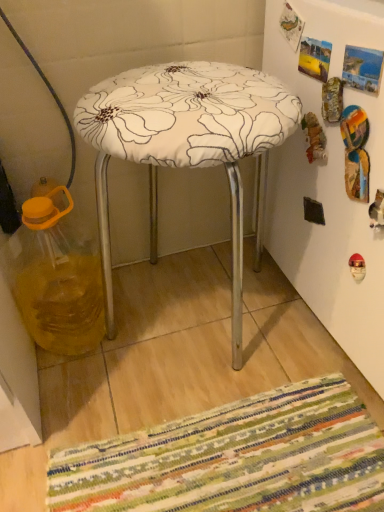
Question: From a real-world perspective, is translucent yellow liquid at left above or below white fabric-covered stool at center?

Choices:
 (A) below
 (B) above

Answer: (A)

Question: Does point (66, 254) appear closer or farther from the camera than point (125, 118)?

Choices:
 (A) closer
 (B) farther

Answer: (B)

Question: Looking at the image, does translucent yellow liquid at left seem bigger or smaller compared to white fabric-covered stool at center?

Choices:
 (A) big
 (B) small

Answer: (B)

Question: From a real-world perspective, is white fabric-covered stool at center above or below translucent yellow liquid at left?

Choices:
 (A) above
 (B) below

Answer: (A)

Question: Relative to translucent yellow liquid at left, is white fabric-covered stool at center in front or behind?

Choices:
 (A) behind
 (B) front

Answer: (B)

Question: Is white fabric-covered stool at center to the left or to the right of translucent yellow liquid at left in the image?

Choices:
 (A) left
 (B) right

Answer: (B)

Question: Considering the positions of point (145, 94) and point (8, 245), is point (145, 94) closer or farther from the camera than point (8, 245)?

Choices:
 (A) closer
 (B) farther

Answer: (A)